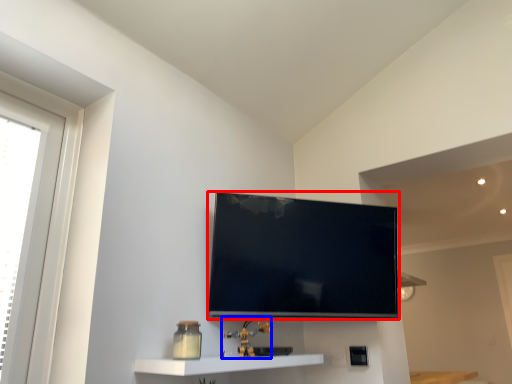
Question: Which point is closer to the camera, television (highlighted by a red box) or toy (highlighted by a blue box)?

Choices:
 (A) television
 (B) toy

Answer: (B)